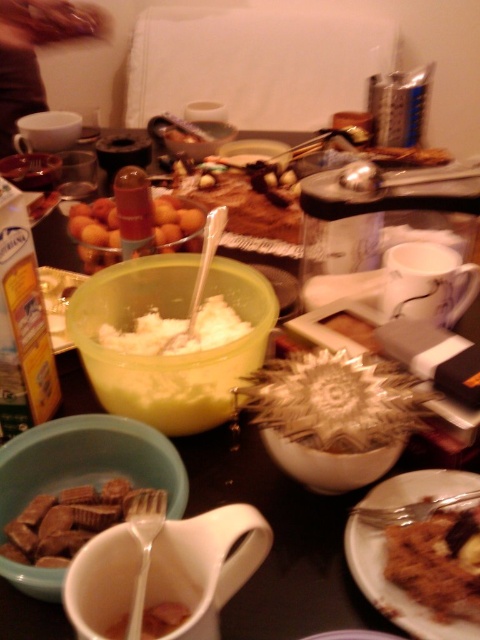
Is brown crumbly cake at center taller than brown matte peanut butter at lower left?

Indeed, brown crumbly cake at center has a greater height compared to brown matte peanut butter at lower left.

Can you confirm if brown crumbly cake at center is smaller than brown matte peanut butter at lower left?

Indeed, brown crumbly cake at center has a smaller size compared to brown matte peanut butter at lower left.

Does point (395, 579) come closer to viewer compared to point (21, 554)?

Yes, it is in front of point (21, 554).

At what (x,y) coordinates should I click in order to perform the action: click on brown crumbly cake at center. Please return your answer as a coordinate pair (x, y). Image resolution: width=480 pixels, height=640 pixels. Looking at the image, I should click on (436, 563).

Is brown crumbly cake at center bigger than white creamy substance at center?

Incorrect, brown crumbly cake at center is not larger than white creamy substance at center.

Who is more distant from viewer, (415, 593) or (137, 340)?

The point (137, 340) is more distant.

The height and width of the screenshot is (640, 480). Find the location of `brown crumbly cake at center`. brown crumbly cake at center is located at coordinates (436, 563).

Who is more forward, (24, 461) or (103, 525)?

Point (103, 525) is in front.

Is matte plastic bowl at lower left to the right of brown matte peanut butter at lower left from the viewer's perspective?

No, matte plastic bowl at lower left is not to the right of brown matte peanut butter at lower left.

Where is `matte plastic bowl at lower left`? The height and width of the screenshot is (640, 480). matte plastic bowl at lower left is located at coordinates (87, 461).